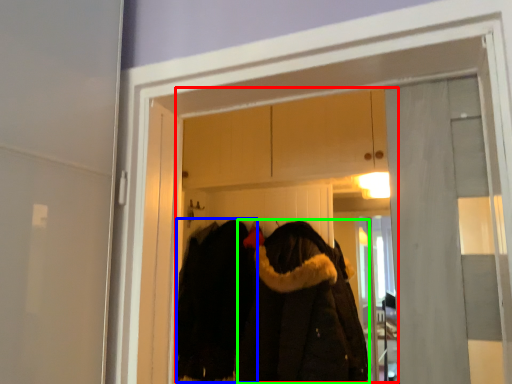
Question: Based on their relative distances, which object is nearer to clothing store (highlighted by a red box)? Choose from cloak (highlighted by a blue box) and cloak (highlighted by a green box).

Choices:
 (A) cloak
 (B) cloak

Answer: (A)